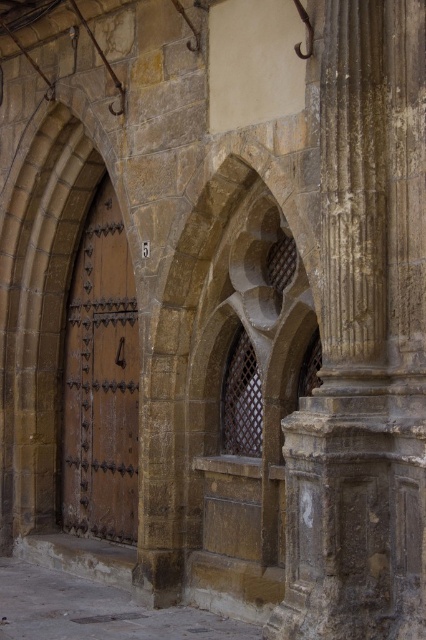
Question: Is brown stone archway at center below matte brown door at center?

Choices:
 (A) no
 (B) yes

Answer: (A)

Question: Is brown stone column at right bigger than brown wooden door at left?

Choices:
 (A) yes
 (B) no

Answer: (A)

Question: Can you confirm if brown stone archway at center is positioned above brown wooden door at left?

Choices:
 (A) yes
 (B) no

Answer: (A)

Question: Among these objects, which one is nearest to the camera?

Choices:
 (A) matte brown door at center
 (B) brown wooden door at left
 (C) brown stone archway at center

Answer: (C)

Question: Considering the real-world distances, which object is farthest from the brown wooden door at left?

Choices:
 (A) matte brown door at center
 (B) brown stone archway at center
 (C) brown stone column at right

Answer: (C)

Question: Among these points, which one is farthest from the camera?

Choices:
 (A) (210, 371)
 (B) (118, 397)
 (C) (20, 284)
 (D) (388, 621)

Answer: (C)